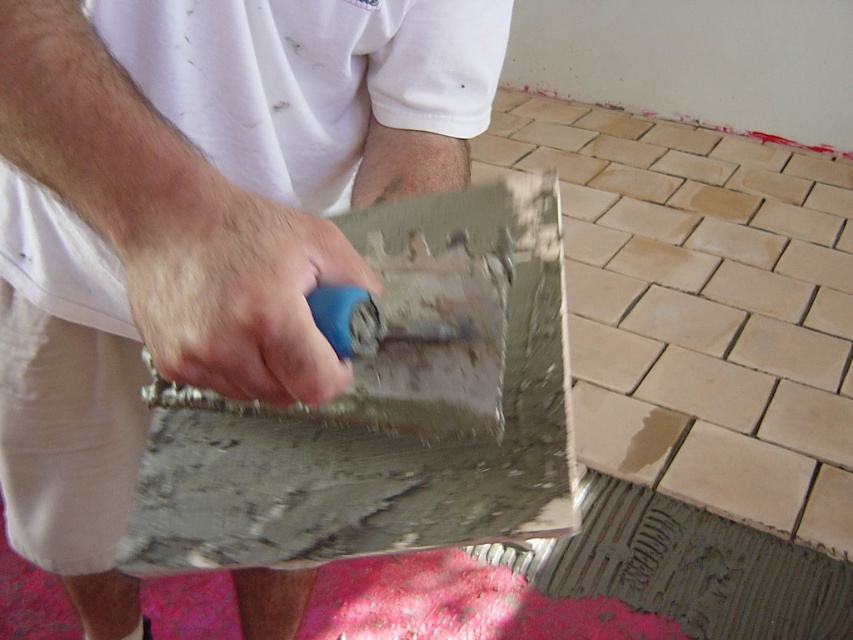
You are a contractor assessing the tiling project. You see the smooth concrete trowel at center and the gray matte cement at lower right. Which tool is shorter?

The smooth concrete trowel at center is shorter than the gray matte cement at lower right.

You are a contractor assessing the tiling area. You see the gray matte cement at lower right and the blue plastic trowel at center. Which object is wider?

The gray matte cement at lower right is wider than the blue plastic trowel at center.